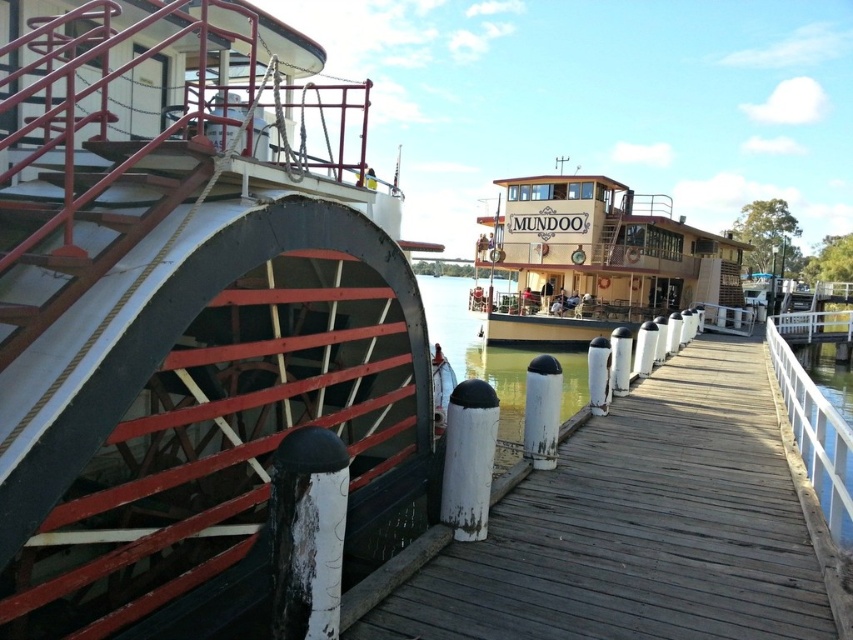
Consider the image. Which of these two, wooden dock at center or wooden polished boat at center, stands shorter?

With less height is wooden dock at center.

Which is more to the right, wooden dock at center or wooden polished boat at center?

Positioned to the right is wooden polished boat at center.

The width and height of the screenshot is (853, 640). Find the location of `wooden dock at center`. wooden dock at center is located at coordinates (636, 528).

How distant is wooden paddlewheel at left from wooden dock at center?

wooden paddlewheel at left is 21.18 feet away from wooden dock at center.

This screenshot has height=640, width=853. I want to click on wooden paddlewheel at left, so (189, 314).

You are a GUI agent. You are given a task and a screenshot of the screen. Output one action in this format:
    pyautogui.click(x=<x>, y=<y>)
    Task: Click on the wooden paddlewheel at left
    The height and width of the screenshot is (640, 853).
    Given the screenshot: What is the action you would take?
    pyautogui.click(x=189, y=314)

Is wooden paddlewheel at left closer to camera compared to wooden polished boat at center?

That is True.

Can you confirm if wooden paddlewheel at left is bigger than wooden polished boat at center?

No, wooden paddlewheel at left is not bigger than wooden polished boat at center.

Who is more distant from viewer, (399,492) or (677,228)?

Point (677,228)

Find the location of a particular element. This screenshot has width=853, height=640. wooden paddlewheel at left is located at coordinates (189, 314).